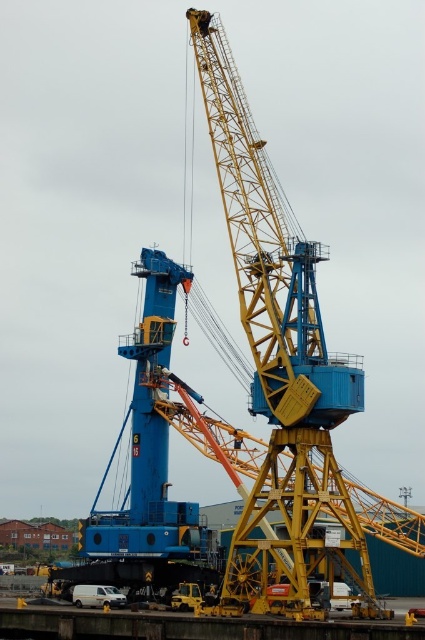
Who is taller, yellow metallic crane at center or yellow metal dock at lower center?

yellow metallic crane at center

Which is above, yellow metallic crane at center or yellow metal dock at lower center?

yellow metallic crane at center

Does point (255, 548) come behind point (59, 628)?

That is True.

The height and width of the screenshot is (640, 425). What are the coordinates of `yellow metallic crane at center` in the screenshot? It's located at (280, 353).